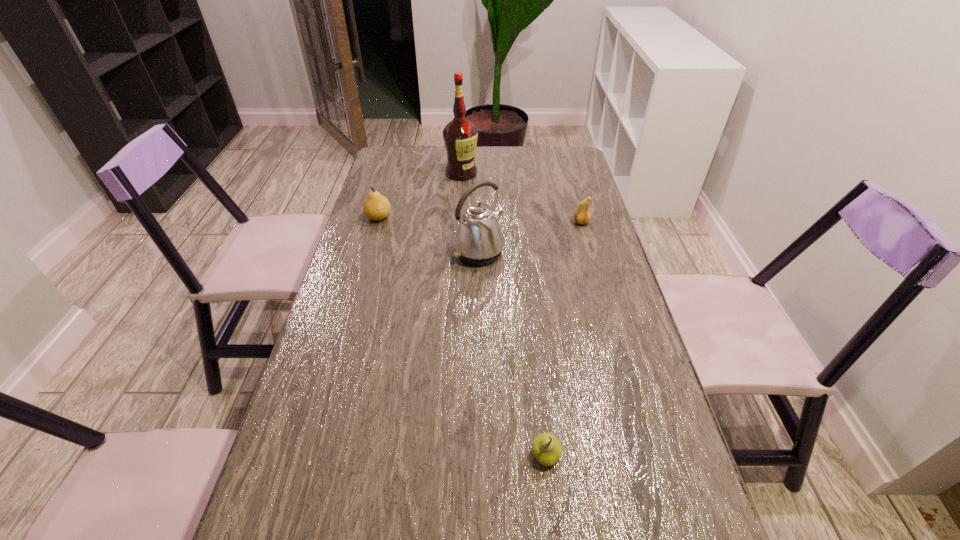
Locate an element on the screen. The width and height of the screenshot is (960, 540). vacant space located 0.070m on the front of the fourth farthest object is located at coordinates (479, 287).

I want to click on vacant space located 0.080m on the front of the tallest pear, so click(372, 241).

Find the location of `free space located 0.240m on the back of the rightmost pear`. free space located 0.240m on the back of the rightmost pear is located at coordinates (569, 180).

Where is `vacant region located on the left of the nearest object`? The width and height of the screenshot is (960, 540). vacant region located on the left of the nearest object is located at coordinates (486, 455).

Image resolution: width=960 pixels, height=540 pixels. What are the coordinates of `object at the far edge` in the screenshot? It's located at (460, 136).

Locate an element on the screen. object present at the left edge is located at coordinates (376, 207).

Find the location of a particular element. object positioned at the right edge is located at coordinates (582, 215).

What are the coordinates of `vacant space at the far edge of the desktop` in the screenshot? It's located at (480, 153).

At what (x,y) coordinates should I click in order to perform the action: click on vacant area at the left edge. Please return your answer as a coordinate pair (x, y). The width and height of the screenshot is (960, 540). Looking at the image, I should click on pyautogui.click(x=384, y=315).

You are a GUI agent. You are given a task and a screenshot of the screen. Output one action in this format:
    pyautogui.click(x=<x>, y=<y>)
    Task: Click on the vacant space at the right edge
    
    Given the screenshot: What is the action you would take?
    pyautogui.click(x=632, y=360)